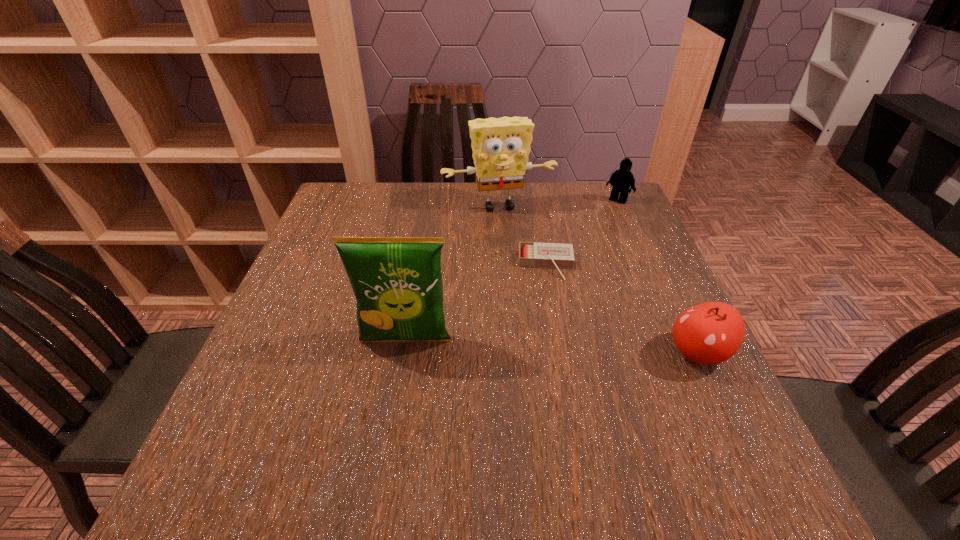
You are a GUI agent. You are given a task and a screenshot of the screen. Output one action in this format:
    pyautogui.click(x=<x>, y=<y>)
    Task: Click on the Lego located in the right edge section of the desktop
    The image size is (960, 540).
    Given the screenshot: What is the action you would take?
    pyautogui.click(x=622, y=179)

Identify the location of object positioned at the far right corner. This screenshot has width=960, height=540. (622, 179).

Find the location of a particular element. vacant space at the far edge of the desktop is located at coordinates (449, 223).

The height and width of the screenshot is (540, 960). Find the location of `vacant space at the left edge of the desktop`. vacant space at the left edge of the desktop is located at coordinates (308, 256).

This screenshot has height=540, width=960. I want to click on free space at the right edge, so click(x=649, y=322).

Image resolution: width=960 pixels, height=540 pixels. I want to click on vacant region at the near left corner of the desktop, so click(231, 421).

This screenshot has height=540, width=960. In order to click on vacant space at the far right corner of the desktop in this screenshot , I will do `click(598, 197)`.

At what (x,y) coordinates should I click in order to perform the action: click on free point at the near right corner. Please return your answer as a coordinate pair (x, y). The image size is (960, 540). Looking at the image, I should click on (641, 401).

Where is `empty space between the third farthest object and the sponge`? empty space between the third farthest object and the sponge is located at coordinates (522, 235).

At what (x,y) coordinates should I click in order to perform the action: click on empty location between the Lego and the sponge. Please return your answer as a coordinate pair (x, y). The image size is (960, 540). Looking at the image, I should click on (559, 203).